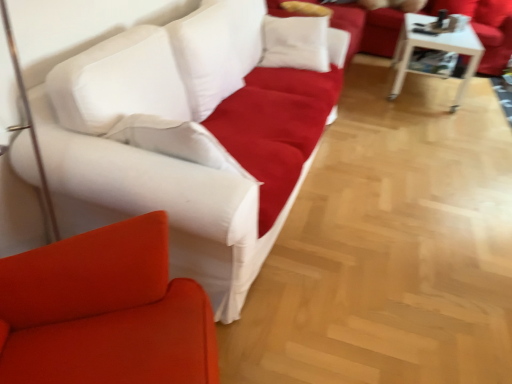
Question: Considering the relative sizes of matte white studio couch at upper center, which is the 2th studio couch in bottom-to-top order, and white glossy table at upper right in the image provided, is matte white studio couch at upper center, which is the 2th studio couch in bottom-to-top order, smaller than white glossy table at upper right?

Choices:
 (A) yes
 (B) no

Answer: (B)

Question: From the image's perspective, is matte white studio couch at upper center, arranged as the 2th studio couch when viewed from the front, over white glossy table at upper right?

Choices:
 (A) no
 (B) yes

Answer: (B)

Question: Is matte white studio couch at upper center, arranged as the 1th studio couch when viewed from the right, oriented towards white glossy table at upper right?

Choices:
 (A) yes
 (B) no

Answer: (B)

Question: From a real-world perspective, is matte white studio couch at upper center, which is the 2th studio couch in bottom-to-top order, on top of white glossy table at upper right?

Choices:
 (A) yes
 (B) no

Answer: (A)

Question: Is matte white studio couch at upper center, which is the first studio couch from top to bottom, not close to white glossy table at upper right?

Choices:
 (A) yes
 (B) no

Answer: (B)

Question: In terms of size, does white fabric couch at center, which is the first studio couch from front to back, appear bigger or smaller than white glossy table at upper right?

Choices:
 (A) small
 (B) big

Answer: (B)

Question: Would you say white fabric couch at center, which is the first studio couch from front to back, is to the left or to the right of white glossy table at upper right in the picture?

Choices:
 (A) left
 (B) right

Answer: (A)

Question: From the image's perspective, is white fabric couch at center, which is counted as the 2th studio couch, starting from the back, positioned above or below white glossy table at upper right?

Choices:
 (A) below
 (B) above

Answer: (A)

Question: Relative to white glossy table at upper right, is white fabric couch at center, which is counted as the 2th studio couch, starting from the back, in front or behind?

Choices:
 (A) behind
 (B) front

Answer: (B)

Question: From the image's perspective, is white glossy table at upper right located above or below white fabric couch at center, which is the second studio couch in right-to-left order?

Choices:
 (A) above
 (B) below

Answer: (A)

Question: Visually, is white glossy table at upper right positioned to the left or to the right of white fabric couch at center, arranged as the first studio couch when ordered from the bottom?

Choices:
 (A) left
 (B) right

Answer: (B)

Question: From their relative heights in the image, would you say white glossy table at upper right is taller or shorter than white fabric couch at center, the 1th studio couch viewed from the left?

Choices:
 (A) short
 (B) tall

Answer: (A)

Question: Considering the positions of white glossy table at upper right and white fabric couch at center, the 1th studio couch viewed from the left, in the image, is white glossy table at upper right bigger or smaller than white fabric couch at center, the 1th studio couch viewed from the left,?

Choices:
 (A) big
 (B) small

Answer: (B)

Question: From their relative heights in the image, would you say white glossy table at upper right is taller or shorter than matte white studio couch at upper center, which is the first studio couch from top to bottom?

Choices:
 (A) tall
 (B) short

Answer: (B)

Question: From a real-world perspective, is white glossy table at upper right physically located above or below matte white studio couch at upper center, which is the 2th studio couch in bottom-to-top order?

Choices:
 (A) above
 (B) below

Answer: (B)